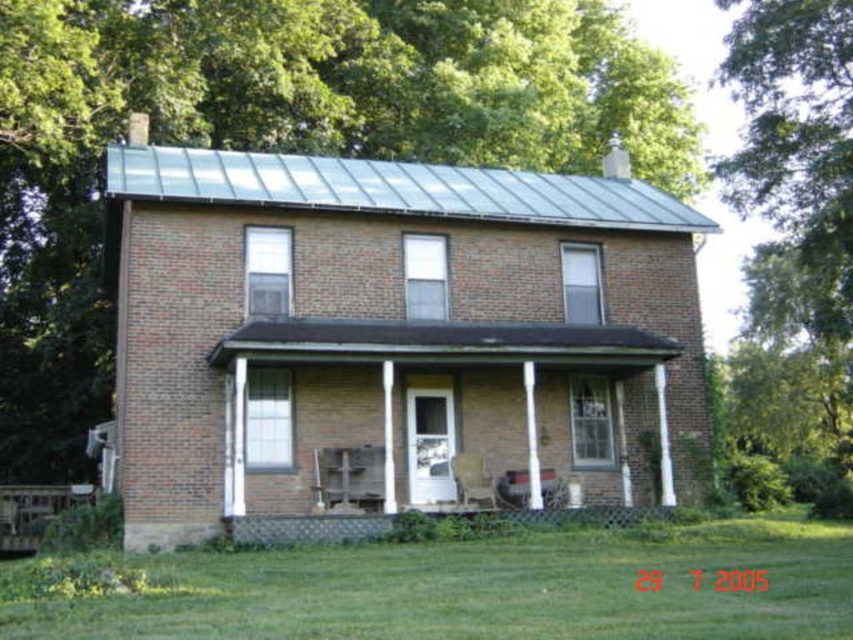
Question: Which point is closer to the camera?

Choices:
 (A) (28, 419)
 (B) (383, 323)
 (C) (289, 563)

Answer: (C)

Question: Where is brick porch at center located in relation to wooden porch at lower center in the image?

Choices:
 (A) above
 (B) below

Answer: (A)

Question: Is brick porch at center thinner than wooden porch at lower center?

Choices:
 (A) no
 (B) yes

Answer: (A)

Question: Does brick porch at center have a smaller size compared to wooden porch at lower center?

Choices:
 (A) no
 (B) yes

Answer: (A)

Question: Which of the following is the closest to the observer?

Choices:
 (A) (645, 513)
 (B) (480, 596)
 (C) (474, 29)

Answer: (B)

Question: Which of these objects is positioned farthest from the green leafy tree at upper center?

Choices:
 (A) wooden porch at lower center
 (B) brick porch at center
 (C) green grass at lower center

Answer: (A)